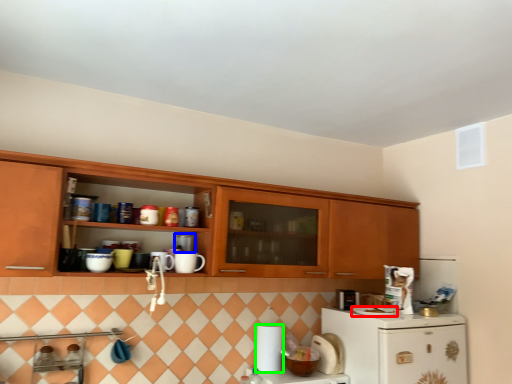
Question: Which object is the closest to the appliance (highlighted by a red box)? Choose among these: appliance (highlighted by a blue box) or paper towel (highlighted by a green box).

Choices:
 (A) appliance
 (B) paper towel

Answer: (B)